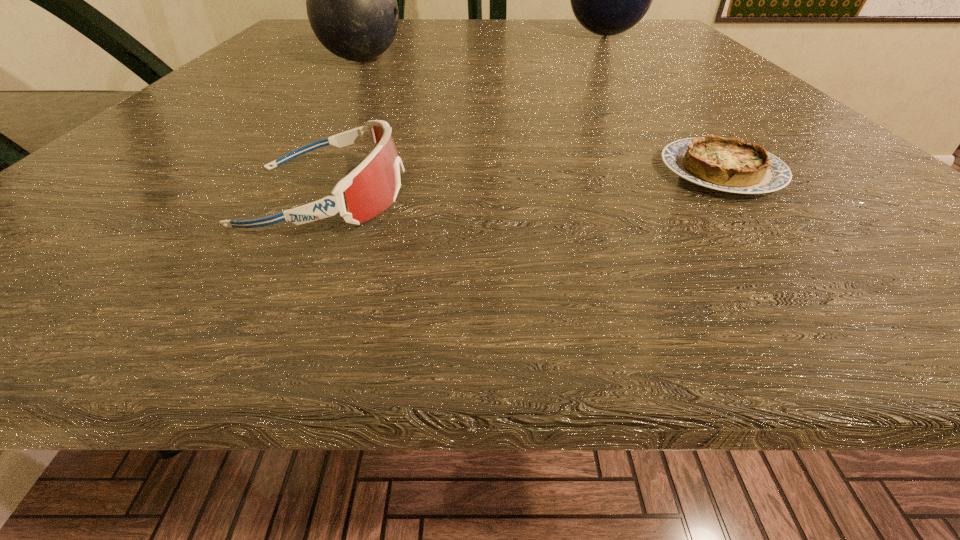
This screenshot has height=540, width=960. Find the location of `free area in between the quiche and the third tallest object`. free area in between the quiche and the third tallest object is located at coordinates (523, 184).

The image size is (960, 540). I want to click on unoccupied position between the shortest object and the farther bowling ball, so click(662, 103).

Where is `vacant area that lies between the right bowling ball and the nearer bowling ball`? The width and height of the screenshot is (960, 540). vacant area that lies between the right bowling ball and the nearer bowling ball is located at coordinates (483, 48).

Image resolution: width=960 pixels, height=540 pixels. In order to click on blank region between the left bowling ball and the shortest object in this screenshot , I will do `click(541, 116)`.

At what (x,y) coordinates should I click in order to perform the action: click on object that ranks as the third closest to the right bowling ball. Please return your answer as a coordinate pair (x, y). The width and height of the screenshot is (960, 540). Looking at the image, I should click on (373, 185).

Identify which object is located as the second nearest to the goggles. Please provide its 2D coordinates. Your answer should be formatted as a tuple, i.e. [(x, y)], where the tuple contains the x and y coordinates of a point satisfying the conditions above.

[(351, 0)]

This screenshot has width=960, height=540. In order to click on vacant region that satisfies the following two spatial constraints: 1. on the grip area of the nearer bowling ball; 2. on the back side of the shortest object in this screenshot , I will do `click(283, 171)`.